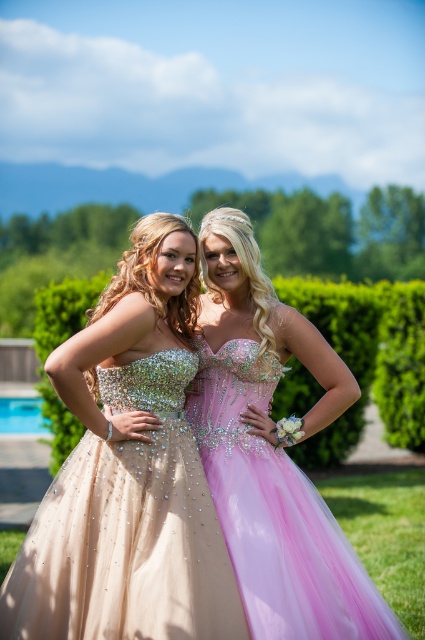
You are standing in the garden and want to take a photo of the sparkly beige dress at center. If your camera can focus on objects up to 15 feet away, will it be able to capture the dress clearly?

The sparkly beige dress at center is 12.98 feet away from the camera, which is within the camera focus range of up to 15 feet. Therefore, the camera can capture the dress clearly.

You are a photographer planning to take a group photo of the two people in the sparkly beige dress at center and the green leafy hedge at center. Since you want to ensure both subjects are fully visible, which one should you prioritize framing closer to the camera?

The sparkly beige dress at center has a lesser width compared to the green leafy hedge at center, so you should prioritize framing the sparkly beige dress at center closer to the camera to ensure it is fully visible.